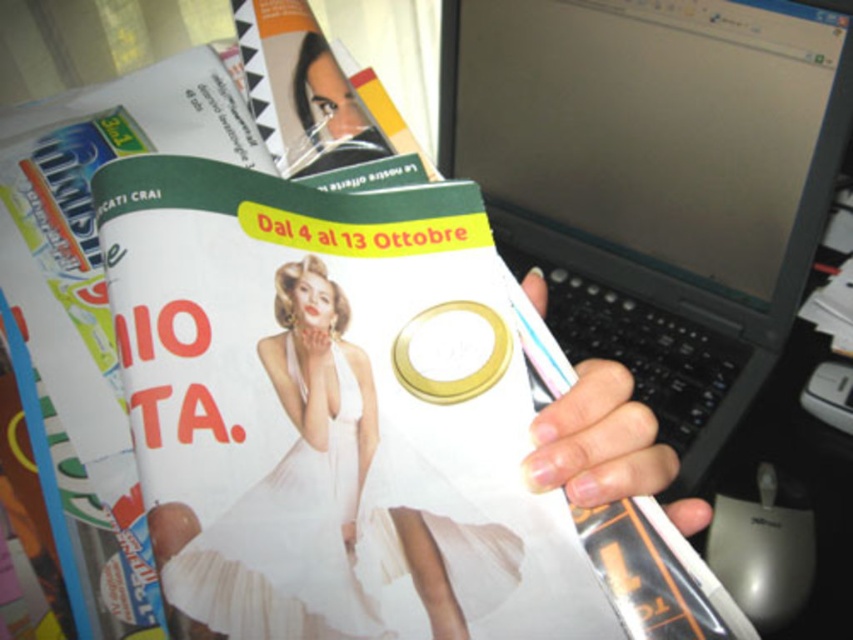
Does point (798, 240) lie behind point (610, 403)?

Yes, it is.

Who is positioned more to the right, black plastic laptop at upper right or nail polish at center?

Positioned to the right is black plastic laptop at upper right.

Does point (712, 348) come behind point (585, 428)?

Yes, it is.

Locate an element on the screen. The width and height of the screenshot is (853, 640). black plastic laptop at upper right is located at coordinates (656, 179).

Is nail polish at center taller than smooth plastic face at upper center?

Correct, nail polish at center is much taller as smooth plastic face at upper center.

Is nail polish at center positioned in front of smooth plastic face at upper center?

Yes.

This screenshot has width=853, height=640. What are the coordinates of `nail polish at center` in the screenshot? It's located at (598, 440).

Can you confirm if black plastic laptop at upper right is positioned to the left of smooth plastic face at upper center?

Incorrect, black plastic laptop at upper right is not on the left side of smooth plastic face at upper center.

Does black plastic laptop at upper right appear over smooth plastic face at upper center?

Yes.

This screenshot has height=640, width=853. In order to click on black plastic laptop at upper right in this screenshot , I will do `click(656, 179)`.

The height and width of the screenshot is (640, 853). In order to click on black plastic laptop at upper right in this screenshot , I will do `click(656, 179)`.